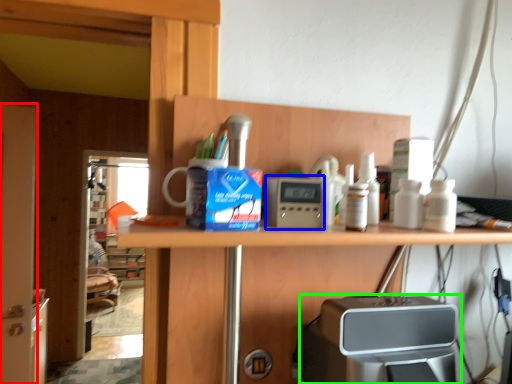
Question: Which is farther away from screen door (highlighted by a red box)? appliance (highlighted by a blue box) or home appliance (highlighted by a green box)?

Choices:
 (A) appliance
 (B) home appliance

Answer: (A)